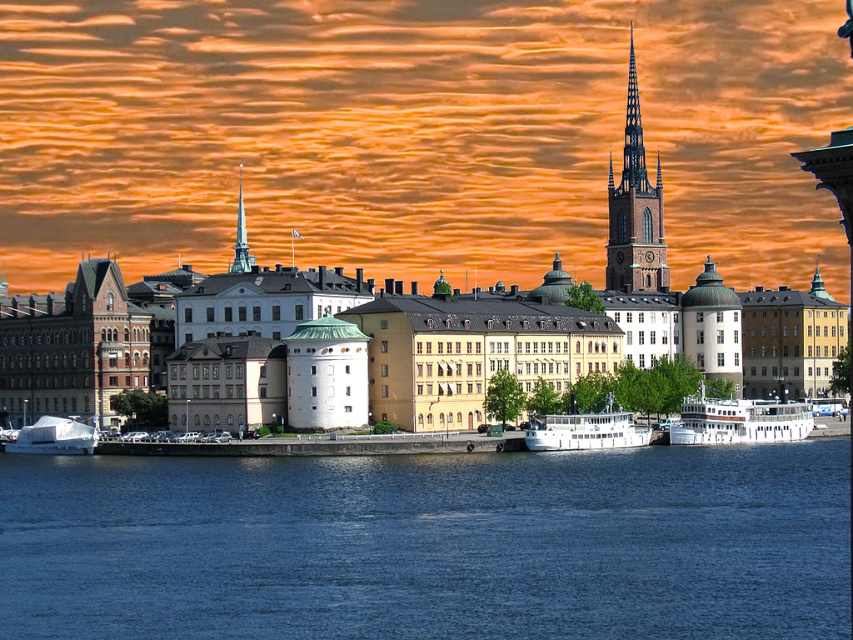
What do you see at coordinates (740, 420) in the screenshot?
I see `white glossy boat at lower right` at bounding box center [740, 420].

Is point (737, 413) positioned in front of point (248, 260)?

Yes, it is in front of point (248, 260).

Which is behind, point (756, 413) or point (236, 250)?

Positioned behind is point (236, 250).

The height and width of the screenshot is (640, 853). I want to click on white glossy boat at lower right, so click(740, 420).

Who is more distant from viewer, [640,285] or [573,444]?

The point [640,285] is behind.

Can you confirm if brown stone spire at upper right is thinner than white matte boat at center?

Incorrect, brown stone spire at upper right's width is not less than white matte boat at center's.

Does point (631, 252) come behind point (619, 428)?

Yes.

You are a GUI agent. You are given a task and a screenshot of the screen. Output one action in this format:
    pyautogui.click(x=<x>, y=<y>)
    Task: Click on the brown stone spire at upper right
    
    Given the screenshot: What is the action you would take?
    pyautogui.click(x=635, y=209)

In the scene shown: Which of these two, white matte boat at center or smooth white spire at center, stands taller?

With more height is smooth white spire at center.

Can you confirm if white matte boat at center is taller than smooth white spire at center?

No.

This screenshot has width=853, height=640. Describe the element at coordinates (585, 428) in the screenshot. I see `white matte boat at center` at that location.

In order to click on white matte boat at center in this screenshot , I will do `click(585, 428)`.